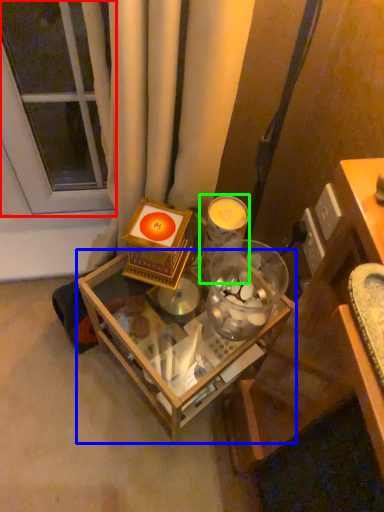
Question: Which is nearer to the glass door (highlighted by a red box)? table (highlighted by a blue box) or candle holder (highlighted by a green box).

Choices:
 (A) table
 (B) candle holder

Answer: (B)